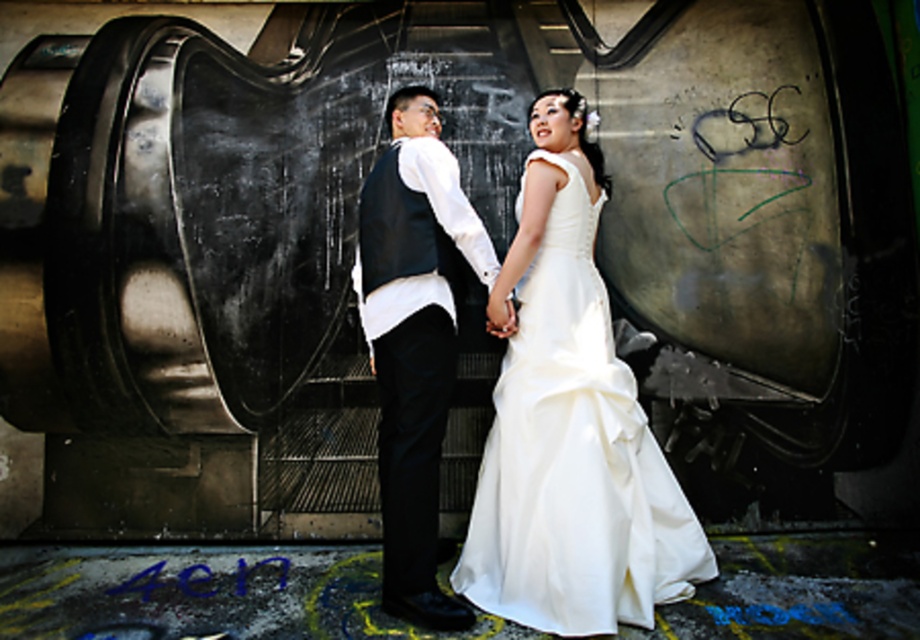
Question: Which point appears closest to the camera in this image?

Choices:
 (A) (441, 152)
 (B) (616, 356)

Answer: (A)

Question: Which of the following is the closest to the observer?

Choices:
 (A) (414, 298)
 (B) (588, 544)

Answer: (B)

Question: Does white satin dress at center appear on the left side of matte black vest at center?

Choices:
 (A) no
 (B) yes

Answer: (A)

Question: Which point is closer to the camera?

Choices:
 (A) (395, 582)
 (B) (515, 492)

Answer: (A)

Question: Does white satin dress at center have a smaller size compared to matte black vest at center?

Choices:
 (A) yes
 (B) no

Answer: (B)

Question: Observing the image, what is the correct spatial positioning of white satin dress at center in reference to matte black vest at center?

Choices:
 (A) below
 (B) above

Answer: (A)